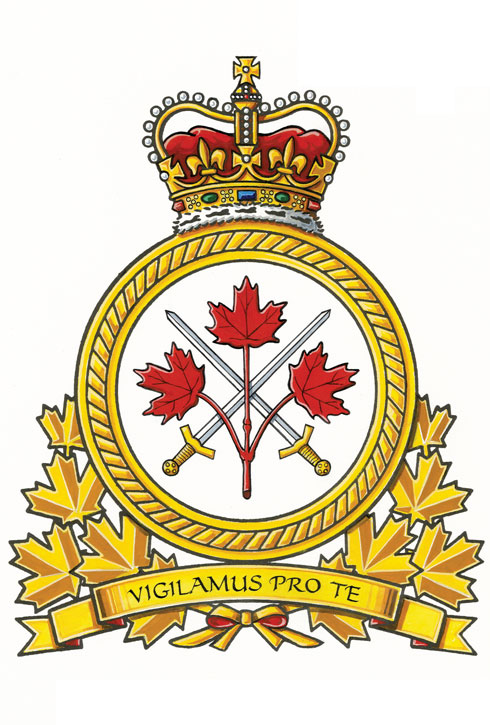
Where is `cushion`? cushion is located at coordinates (309, 149), (214, 141).